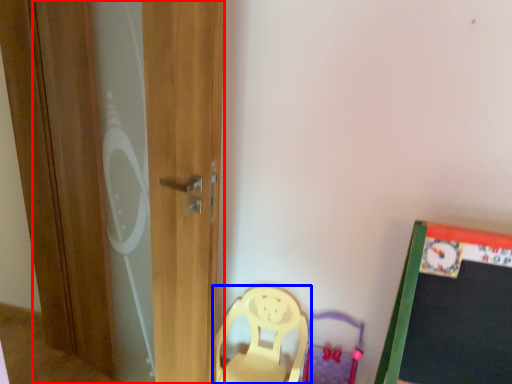
Question: Among these objects, which one is nearest to the camera, screen door (highlighted by a red box) or chair (highlighted by a blue box)?

Choices:
 (A) screen door
 (B) chair

Answer: (A)